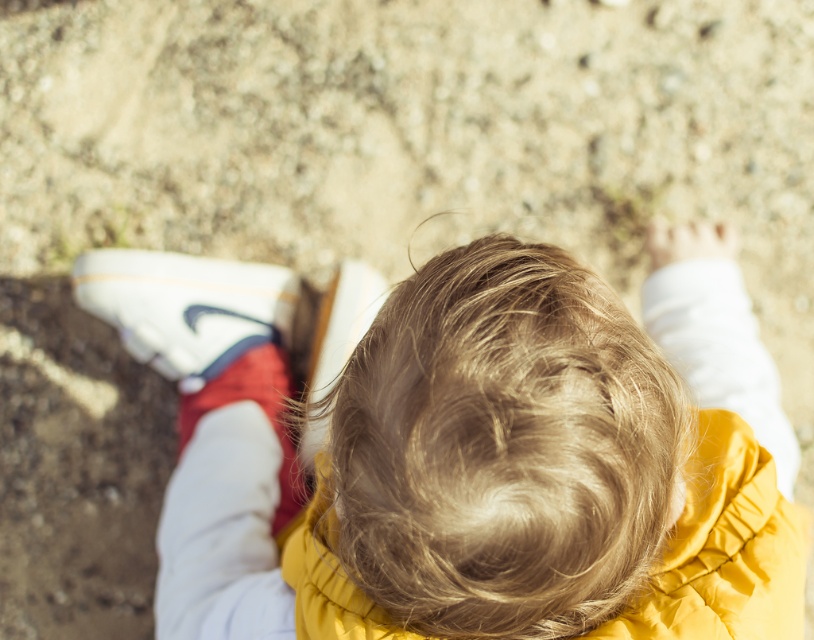
Consider the image. You are a fashion designer observing the child in the image. You need to determine if the smooth yellow jacket at center can be paired with the white leather shoe at lower left based on their sizes. Can they be worn together?

The smooth yellow jacket at center is larger in size than the white leather shoe at lower left, so they can be worn together since size differences do not affect the compatibility of clothing items.

You are a tailor measuring clothing for the child in the image. You need to determine if the smooth yellow jacket at center can be adjusted to fit over the white leather shoe at lower left. Based on their widths, is this possible?

The smooth yellow jacket at center is wider than the white leather shoe at lower left, so it can be adjusted to fit over the shoe.